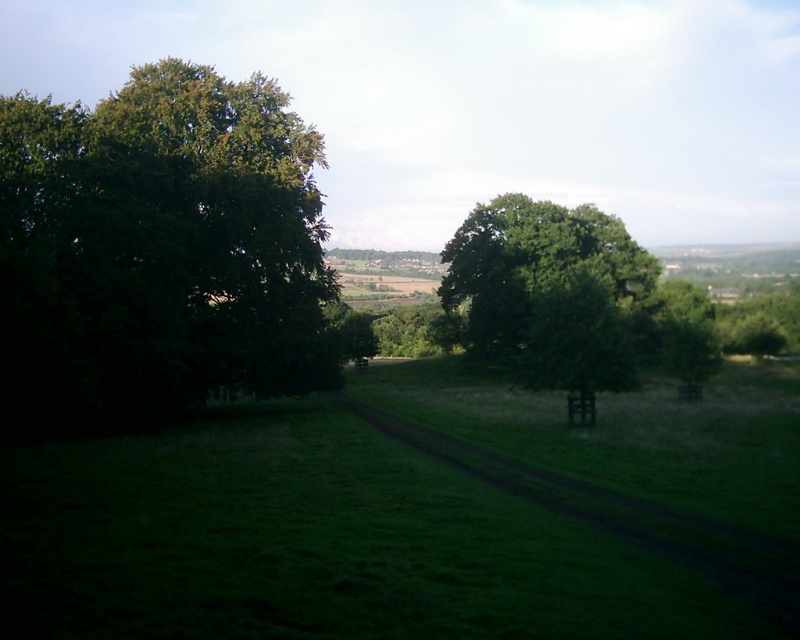
Based on the photo, you are a hiker standing at the start of the dirt path in the field. You want to walk straight ahead towards the horizon. Which tree, the green leafy tree at left or the green leafy tree at center, will you pass by first?

The green leafy tree at left is closer to the viewer than the green leafy tree at center, so you will pass by the green leafy tree at left first as you walk straight ahead.